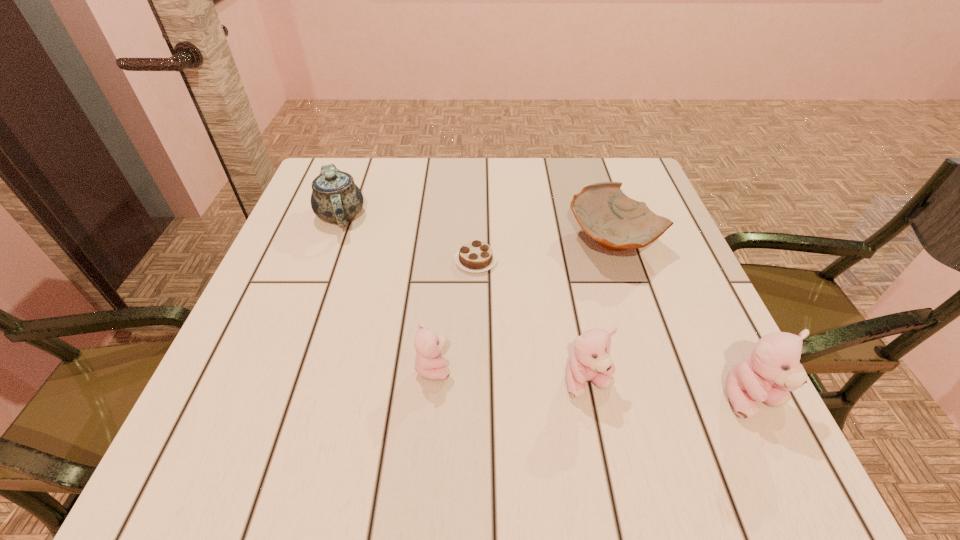
Where is `the shortest teddy bear`? the shortest teddy bear is located at coordinates (429, 364).

At what (x,y) coordinates should I click in order to perform the action: click on the second teddy bear from left to right. Please return your answer as a coordinate pair (x, y). Looking at the image, I should click on (590, 361).

Locate an element on the screen. The height and width of the screenshot is (540, 960). the tallest object is located at coordinates (773, 368).

At what (x,y) coordinates should I click in order to perform the action: click on the tallest teddy bear. Please return your answer as a coordinate pair (x, y). Image resolution: width=960 pixels, height=540 pixels. Looking at the image, I should click on (773, 368).

You are a GUI agent. You are given a task and a screenshot of the screen. Output one action in this format:
    pyautogui.click(x=<x>, y=<y>)
    Task: Click on the pottery
    The height and width of the screenshot is (540, 960).
    Given the screenshot: What is the action you would take?
    pyautogui.click(x=617, y=222)

I want to click on chocolate cake, so click(x=477, y=256).

Identify the location of chinaware. This screenshot has width=960, height=540. click(335, 198).

Where is `free space located 0.200m at the face of the leftmost teddy bear`? free space located 0.200m at the face of the leftmost teddy bear is located at coordinates (565, 367).

Locate an element on the screen. The image size is (960, 540). vacant space situated on the left of the pottery is located at coordinates (541, 241).

Find the location of `free space located on the right of the chocolate cake`. free space located on the right of the chocolate cake is located at coordinates (662, 260).